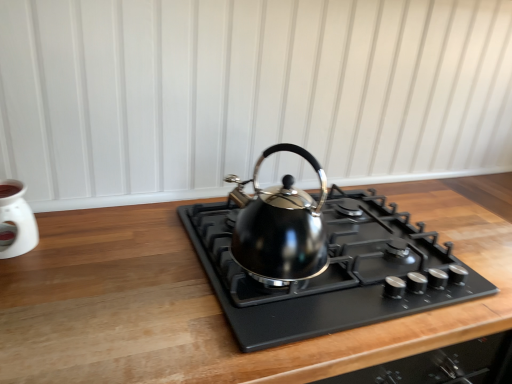
At what (x,y) coordinates should I click in order to perform the action: click on free space in front of white glossy oil burner at left. Please return your answer as a coordinate pair (x, y). Looking at the image, I should click on pos(19,295).